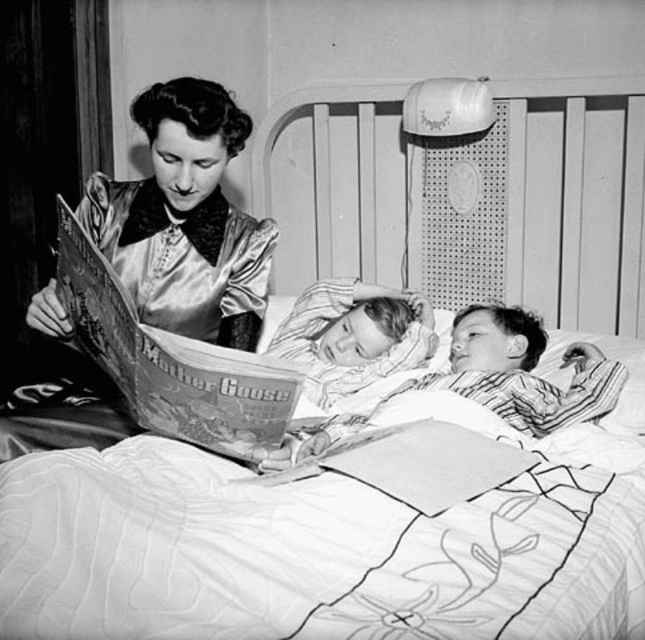
Question: Is printed paper book at left above smooth fabric pillow at center?

Choices:
 (A) no
 (B) yes

Answer: (A)

Question: Which object is positioned farthest from the silky satin dress at upper left?

Choices:
 (A) smooth fabric pillow at center
 (B) printed paper book at left

Answer: (A)

Question: Which of these objects is positioned farthest from the silky satin dress at upper left?

Choices:
 (A) printed paper book at left
 (B) smooth fabric pillow at center

Answer: (B)

Question: Does printed paper book at left appear under smooth fabric pillow at center?

Choices:
 (A) no
 (B) yes

Answer: (B)

Question: Does silky satin dress at upper left appear over smooth fabric pillow at center?

Choices:
 (A) no
 (B) yes

Answer: (B)

Question: Which point appears farthest from the camera in this image?

Choices:
 (A) (284, 356)
 (B) (199, 381)

Answer: (A)